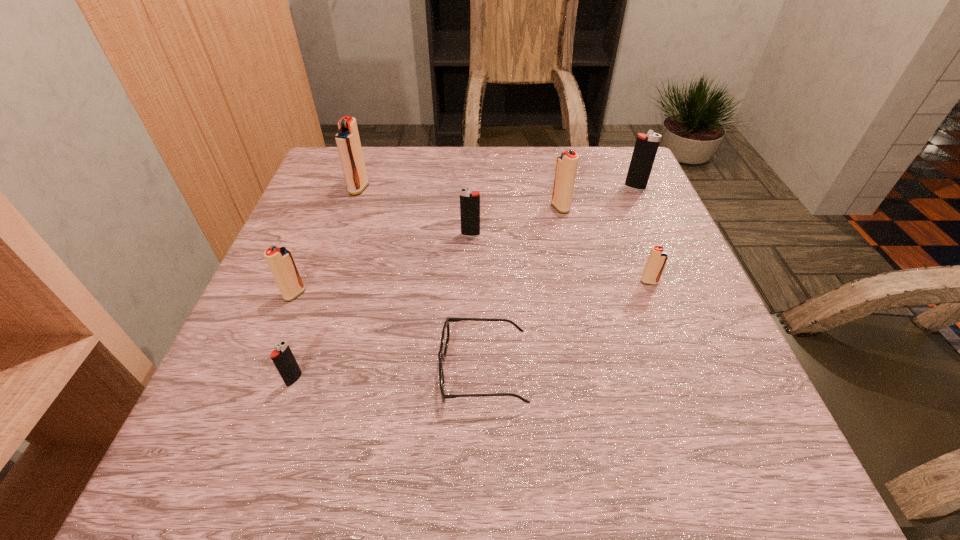
The width and height of the screenshot is (960, 540). In the image, there is a desktop. Identify the location of vacant region at the right edge. (648, 250).

Locate an element on the screen. The width and height of the screenshot is (960, 540). vacant region at the far left corner of the desktop is located at coordinates (312, 194).

You are a GUI agent. You are given a task and a screenshot of the screen. Output one action in this format:
    pyautogui.click(x=<x>, y=<y>)
    Task: Click on the free location at the far right corner
    The image size is (960, 540).
    Given the screenshot: What is the action you would take?
    (594, 179)

This screenshot has height=540, width=960. I want to click on vacant area that lies between the spectacles and the rightmost red igniter, so click(566, 326).

Find the location of a particular element. vacant space that's between the leftmost object and the leftmost black igniter is located at coordinates (295, 337).

Where is `empty location between the rightmost igniter and the nearest igniter`? empty location between the rightmost igniter and the nearest igniter is located at coordinates (465, 284).

At what (x,y) coordinates should I click in order to perform the action: click on free space between the second black igniter from left to right and the sixth nearest object. Please return your answer as a coordinate pair (x, y). Looking at the image, I should click on (516, 221).

Image resolution: width=960 pixels, height=540 pixels. Find the location of `vacant area that lies between the third igniter from right to left and the sixth farthest igniter`. vacant area that lies between the third igniter from right to left and the sixth farthest igniter is located at coordinates (427, 251).

This screenshot has height=540, width=960. What are the coordinates of `vacant space that is in between the shortest object and the smallest black igniter` in the screenshot? It's located at (389, 375).

This screenshot has width=960, height=540. What are the coordinates of `vacant space that's between the third object from right to left and the shortest object` in the screenshot? It's located at coord(521,289).